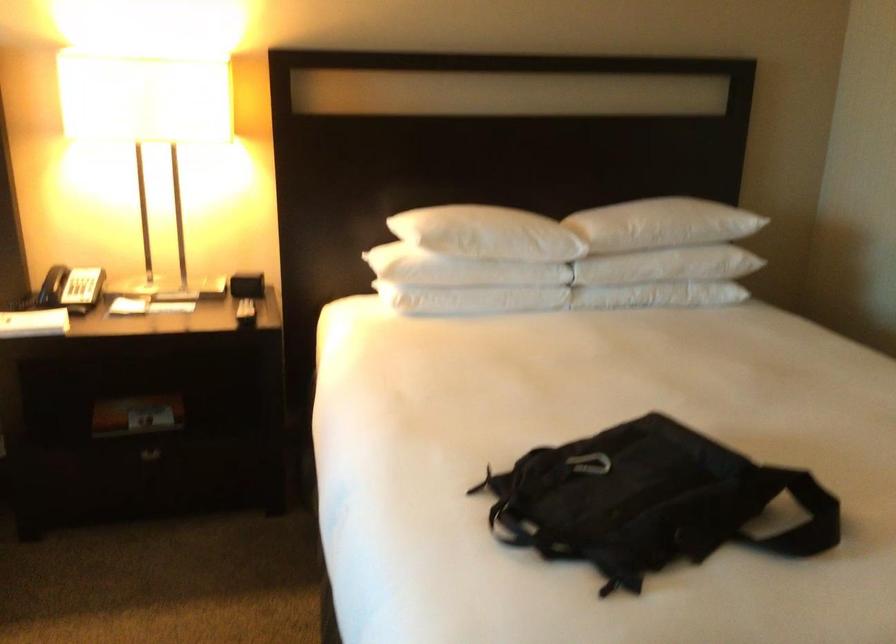
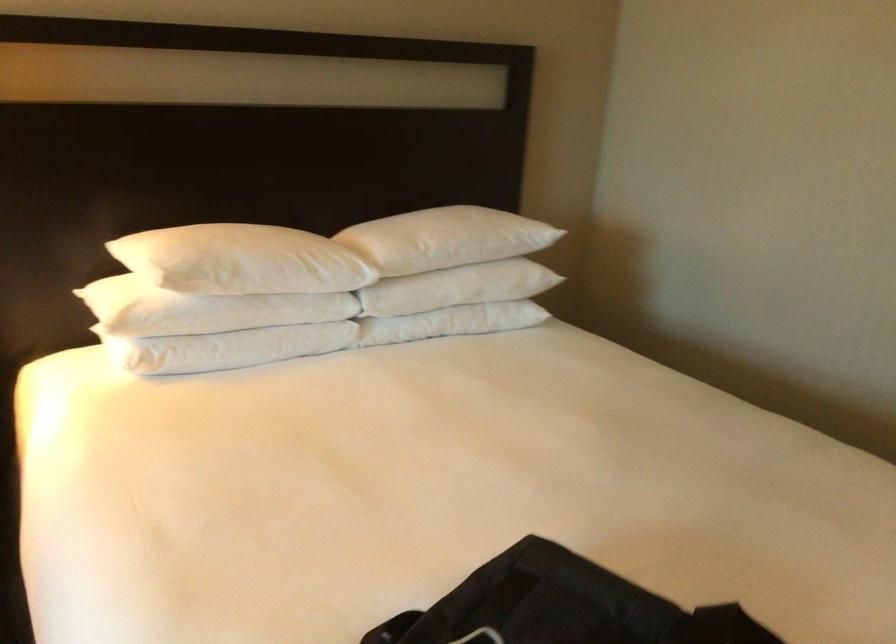
Find the pixel in the second image that matches (462,297) in the first image.

(226, 348)